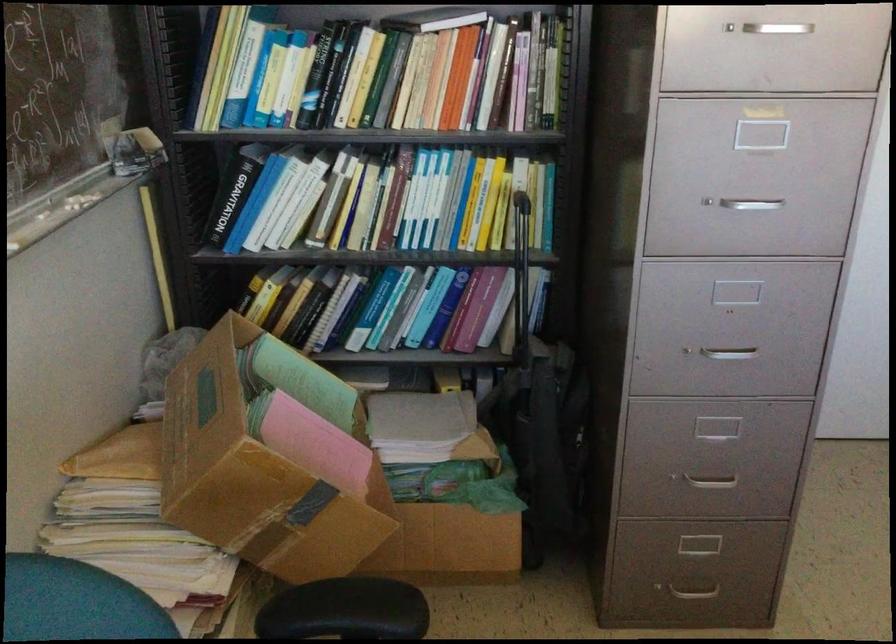
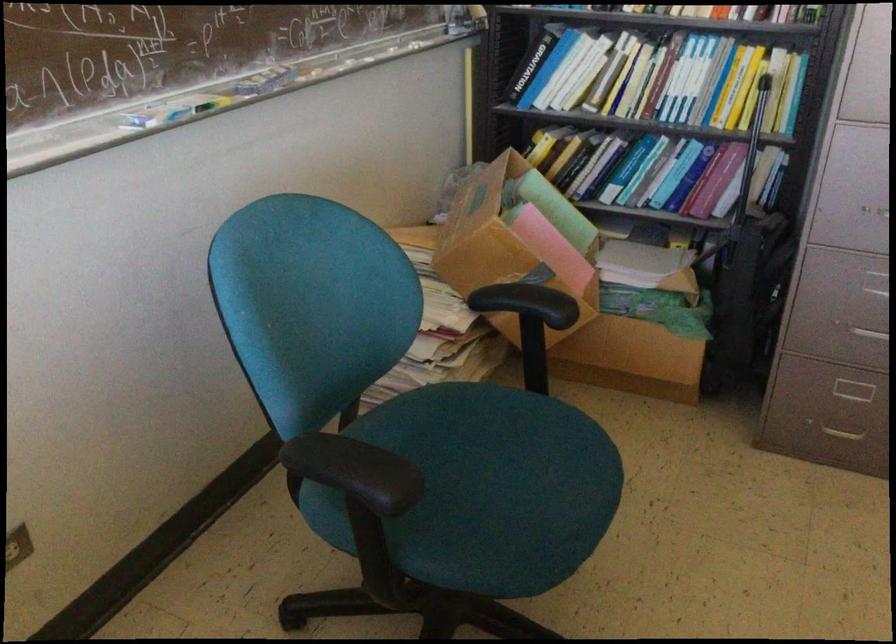
In the second image, find the point that corresponds to point (487, 317) in the first image.

(722, 187)